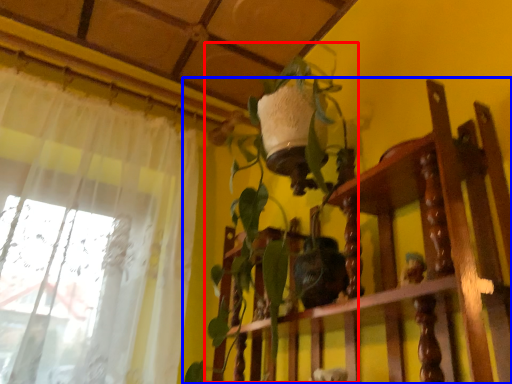
Question: Which object is closer to the camera taking this photo, vegetation (highlighted by a red box) or furniture (highlighted by a blue box)?

Choices:
 (A) vegetation
 (B) furniture

Answer: (B)